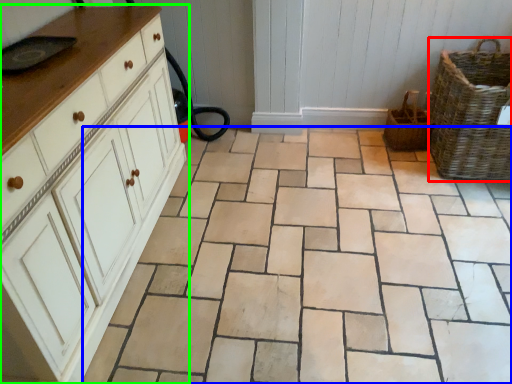
Question: Which object is the farthest from basket (highlighted by a red box)? Choose among these: ceramic tile (highlighted by a blue box) or chest of drawers (highlighted by a green box).

Choices:
 (A) ceramic tile
 (B) chest of drawers

Answer: (B)